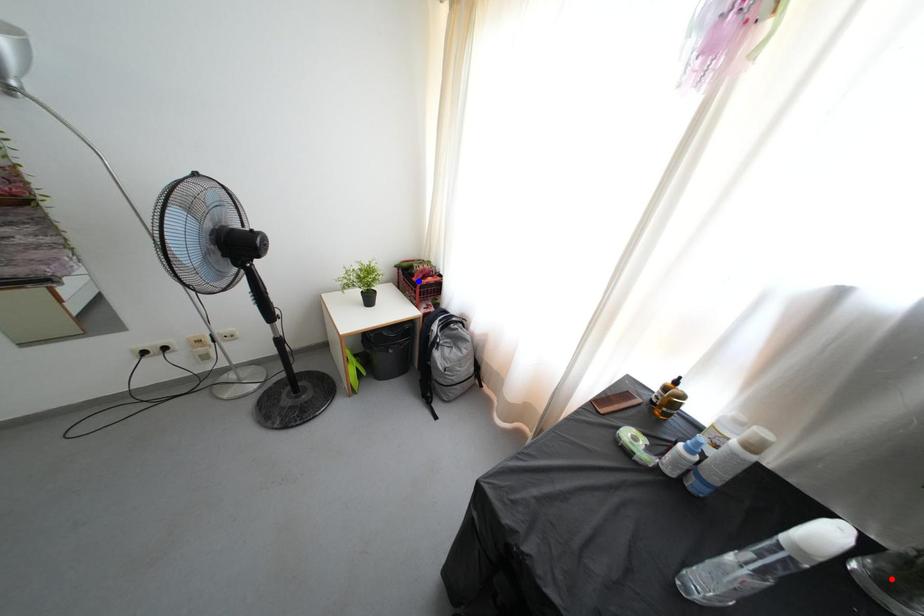
Question: Which of the two points in the image is closer to the camera?

Choices:
 (A) Blue point is closer.
 (B) Red point is closer.

Answer: (B)